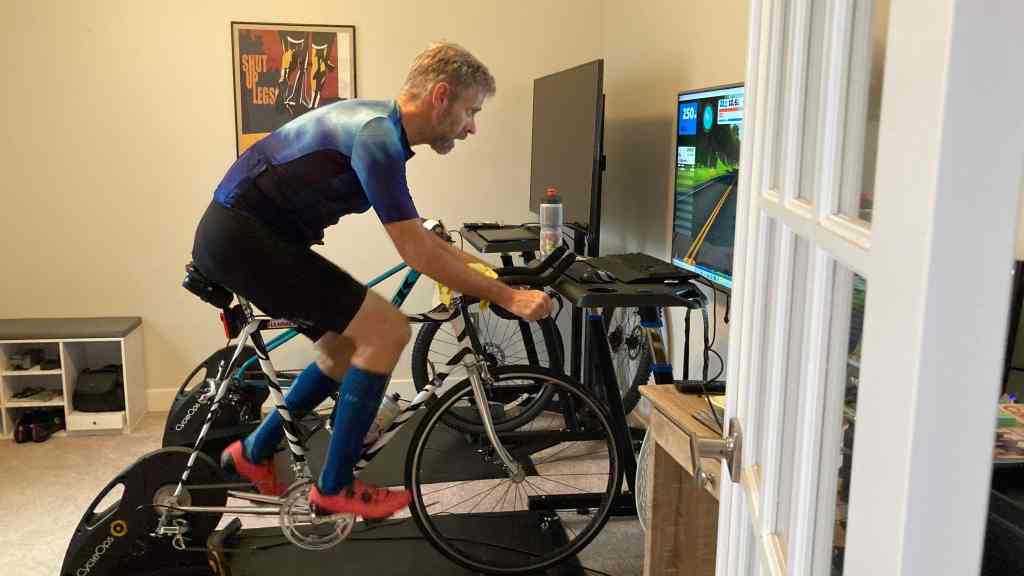
You are a GUI agent. You are given a task and a screenshot of the screen. Output one action in this format:
    pyautogui.click(x=<x>, y=<y>)
    Task: Click on the door knob
    
    Given the screenshot: What is the action you would take?
    pyautogui.click(x=726, y=449)